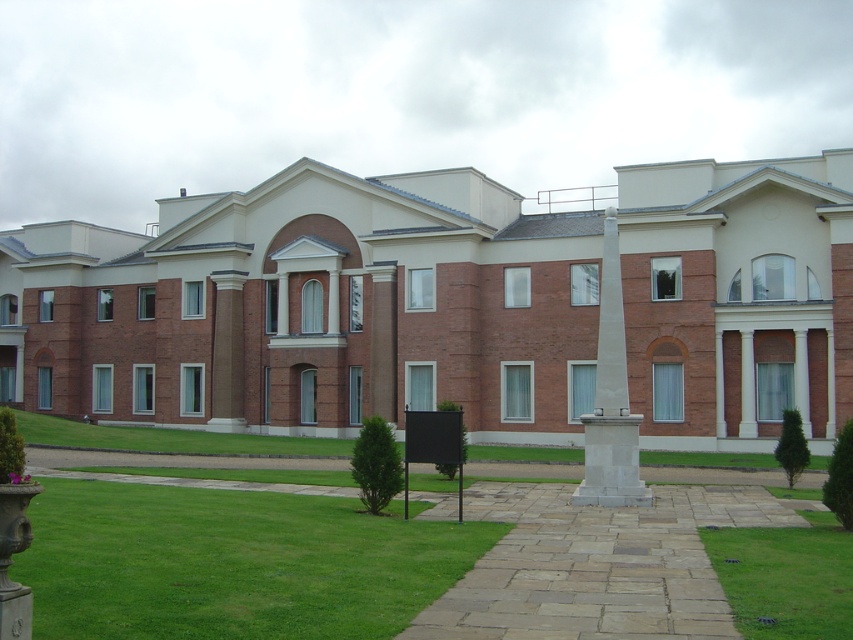
Question: Considering the relative positions of green grass at lower left and white marble obelisk at center in the image provided, where is green grass at lower left located with respect to white marble obelisk at center?

Choices:
 (A) left
 (B) right

Answer: (A)

Question: Can you confirm if green grass at lower left is thinner than white marble obelisk at center?

Choices:
 (A) no
 (B) yes

Answer: (A)

Question: Among these objects, which one is farthest from the camera?

Choices:
 (A) green grass at center
 (B) green grass at lower left

Answer: (A)

Question: Which point is closer to the camera taking this photo?

Choices:
 (A) (219, 621)
 (B) (589, 483)
 (C) (817, 588)

Answer: (A)

Question: Which object is the closest to the green grass at center?

Choices:
 (A) white marble obelisk at center
 (B) green grass at lower left

Answer: (B)

Question: Is green grass at lower left to the right of white marble obelisk at center from the viewer's perspective?

Choices:
 (A) no
 (B) yes

Answer: (A)